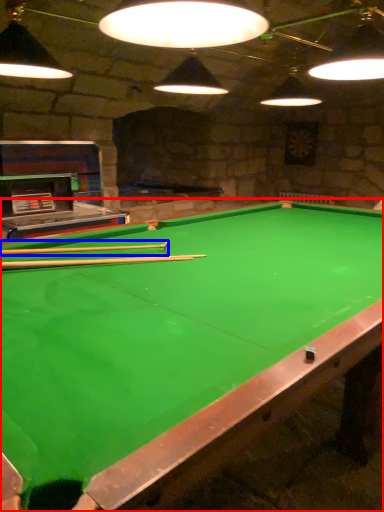
Question: Which object appears farthest to the camera in this image, billiard table (highlighted by a red box) or cue (highlighted by a blue box)?

Choices:
 (A) billiard table
 (B) cue

Answer: (B)